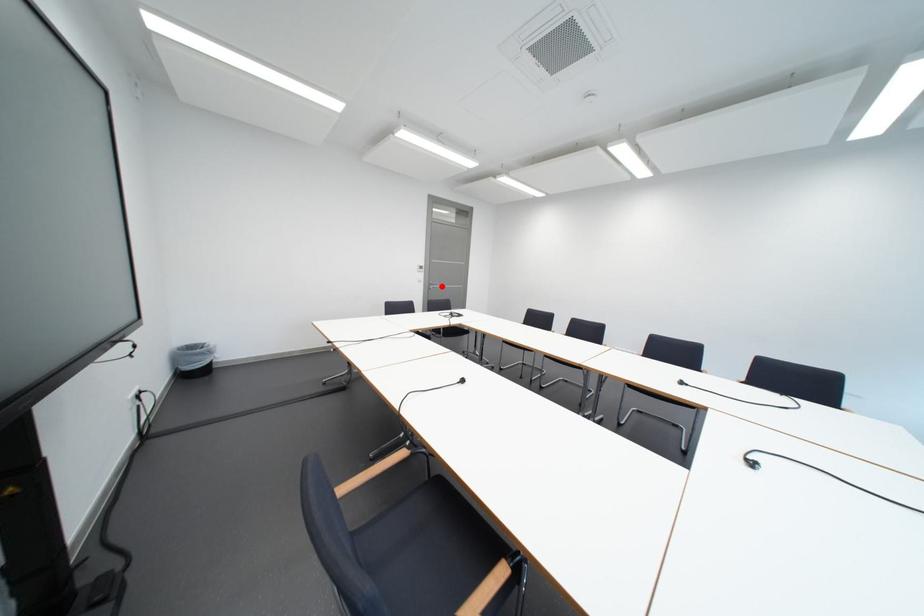
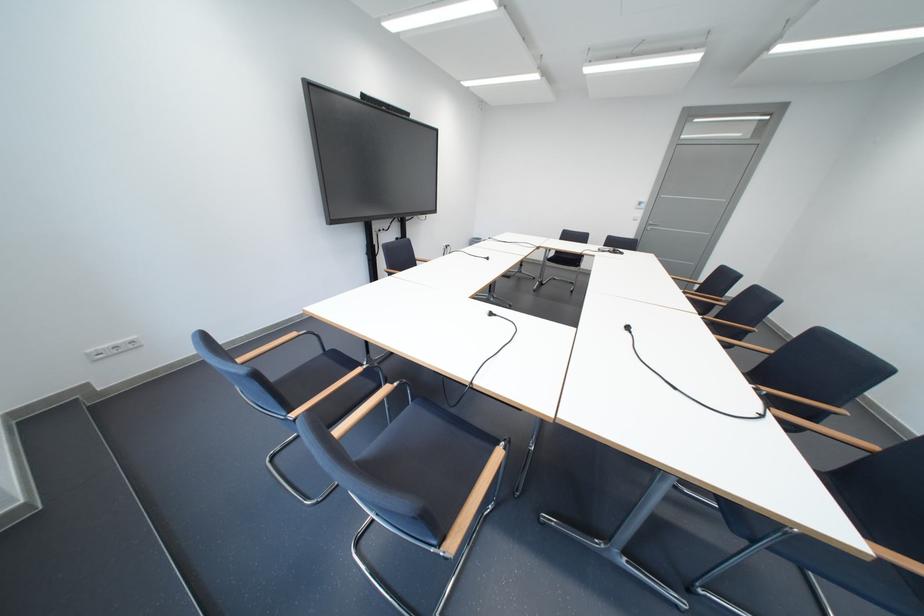
The point at the highlighted location is marked in the first image. Where is the corresponding point in the second image?

(660, 227)